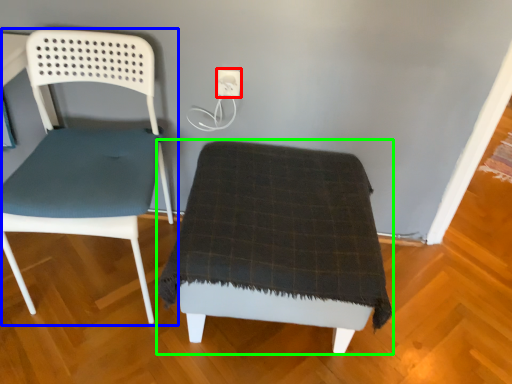
Question: Based on their relative distances, which object is nearer to electric outlet (highlighted by a red box)? Choose from chair (highlighted by a blue box) and furniture (highlighted by a green box).

Choices:
 (A) chair
 (B) furniture

Answer: (A)